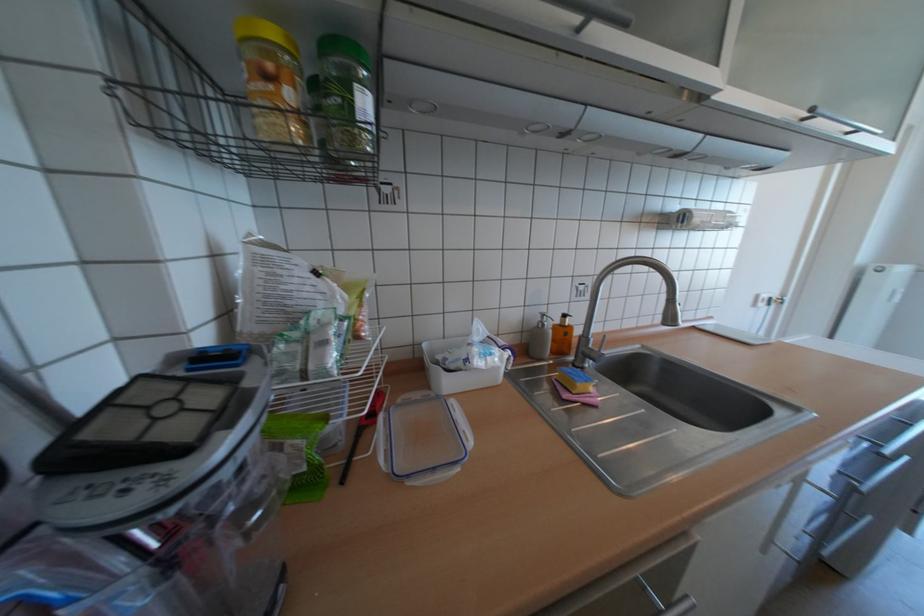
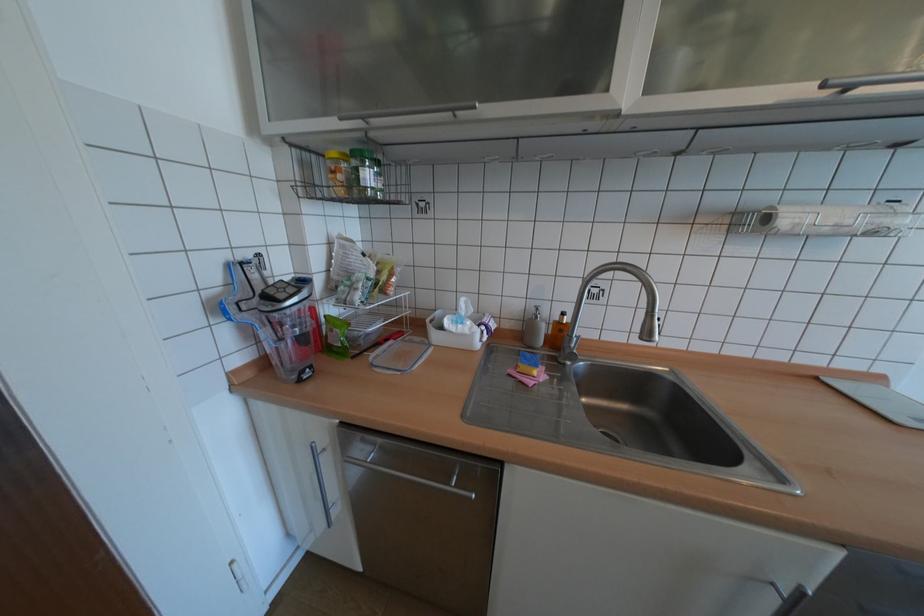
Find the pixel in the second image that matches point (553, 325) in the first image.

(545, 317)